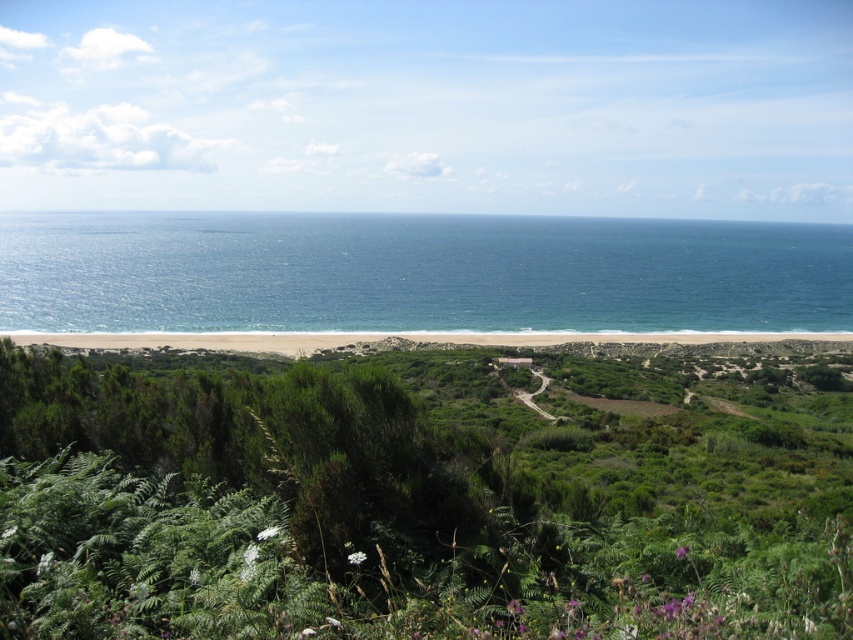
You are standing at the beach looking towards the ocean. There are two points marked in the image. The first point is at coordinates point (171,358) and the second is at point (497,333). Which point is closer to you?

Point (171,358) is closer to the camera than point (497,333).

You are standing at the edge of the sandy beach. You want to walk to the blue water at center. Which direction should you go?

You should walk towards the center of the image to reach the blue water at center since it is located at point coordinates (416, 273).